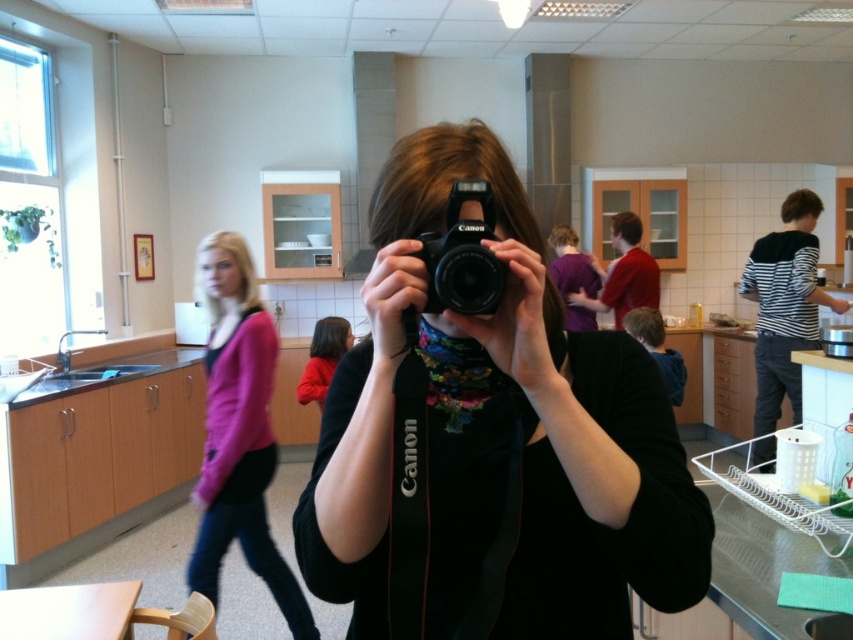
Is the position of black matte camera at center less distant than that of pink sweater at center?

That is True.

Does black matte camera at center appear over pink sweater at center?

Yes.

Which is in front, point (639, 520) or point (264, 573)?

Positioned in front is point (639, 520).

At what (x,y) coordinates should I click in order to perform the action: click on black matte camera at center. Please return your answer as a coordinate pair (x, y). The height and width of the screenshot is (640, 853). Looking at the image, I should click on (492, 444).

Consider the image. Is the position of pink sweater at center less distant than that of black plastic camera at center?

No, pink sweater at center is behind black plastic camera at center.

You are a GUI agent. You are given a task and a screenshot of the screen. Output one action in this format:
    pyautogui.click(x=<x>, y=<y>)
    Task: Click on the pink sweater at center
    The width and height of the screenshot is (853, 640).
    Given the screenshot: What is the action you would take?
    pyautogui.click(x=238, y=432)

This screenshot has height=640, width=853. I want to click on pink sweater at center, so [238, 432].

Can you confirm if black matte camera at center is positioned below black plastic camera at center?

Correct, black matte camera at center is located below black plastic camera at center.

Who is shorter, black matte camera at center or black plastic camera at center?

black plastic camera at center

Describe the element at coordinates (492, 444) in the screenshot. I see `black matte camera at center` at that location.

Image resolution: width=853 pixels, height=640 pixels. I want to click on black matte camera at center, so click(x=492, y=444).